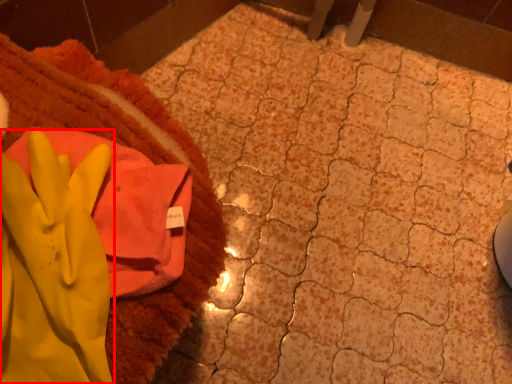
Question: Where is glove (annotated by the red box) located in relation to towel in the image?

Choices:
 (A) left
 (B) right

Answer: (B)